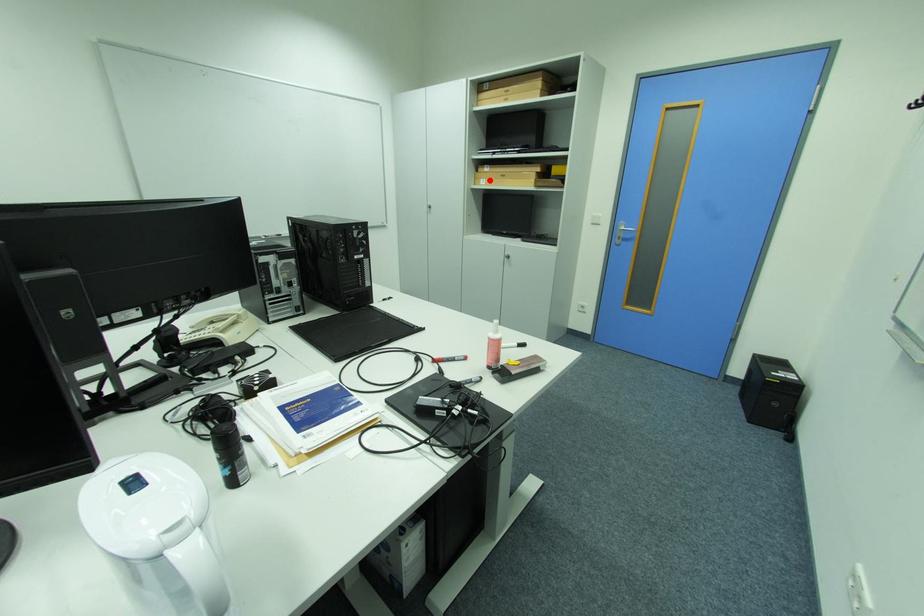
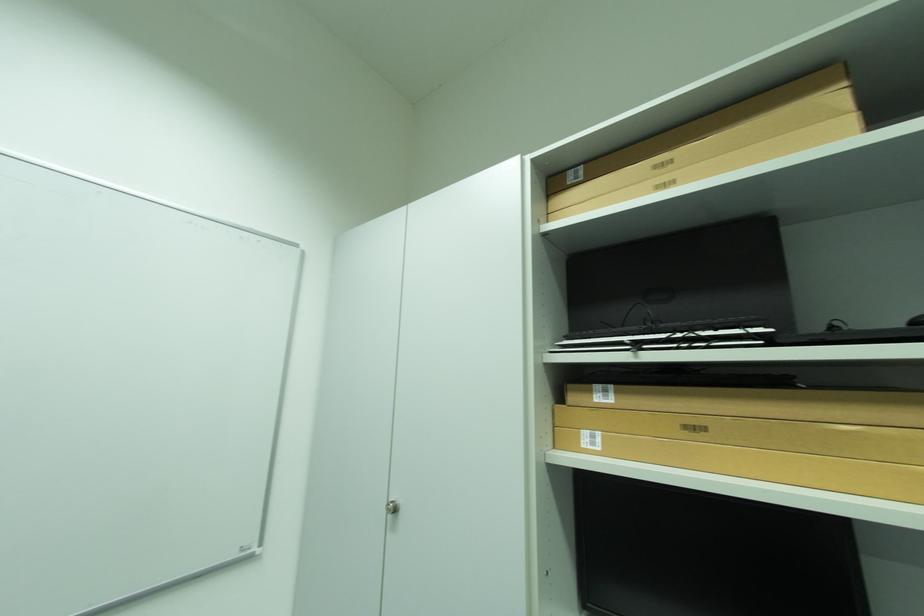
Question: I am providing you with two images of the same scene from different viewpoints. Given a red point in image1, look at the same physical point in image2. Is it:

Choices:
 (A) Closer to the viewpoint
 (B) Farther from the viewpoint

Answer: (B)